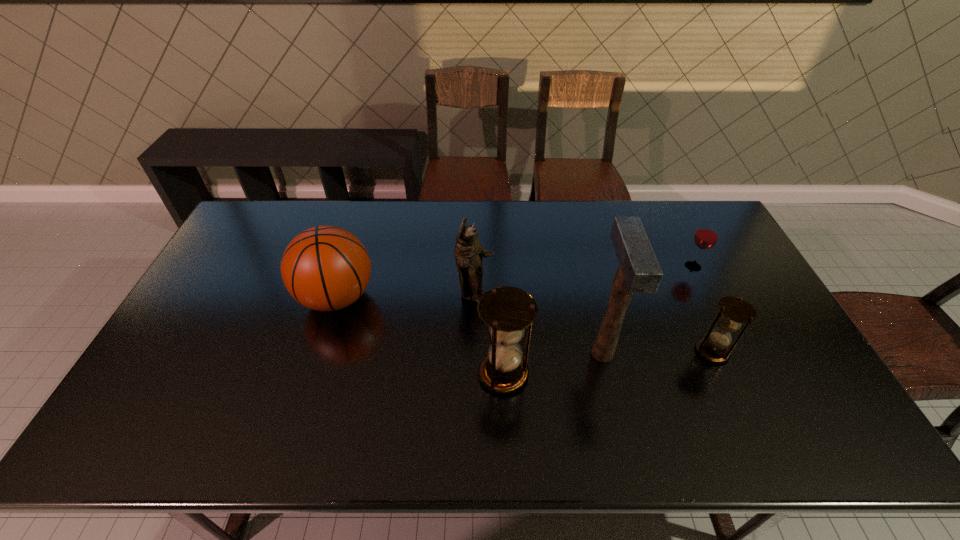
The height and width of the screenshot is (540, 960). What are the coordinates of `the taller hourglass` in the screenshot? It's located at (507, 311).

Identify the location of the right hourglass. 734,311.

Locate an element on the screen. Image resolution: width=960 pixels, height=540 pixels. basketball is located at coordinates (326, 268).

At what (x,y) coordinates should I click in order to perform the action: click on glass. Please return your answer as a coordinate pair (x, y). Image resolution: width=960 pixels, height=540 pixels. Looking at the image, I should click on (706, 236).

Locate an element on the screen. figurine is located at coordinates (469, 253).

Where is `the third object from right to left`? Image resolution: width=960 pixels, height=540 pixels. the third object from right to left is located at coordinates (638, 272).

Find the location of a particular element. Image resolution: width=960 pixels, height=540 pixels. mallet is located at coordinates (638, 272).

Where is `free space located on the back of the taller hourglass`? The height and width of the screenshot is (540, 960). free space located on the back of the taller hourglass is located at coordinates (500, 300).

I want to click on vacant space located on the left of the shorter hourglass, so coord(626,352).

This screenshot has height=540, width=960. I want to click on free space located 0.380m on the back of the basketball, so click(367, 202).